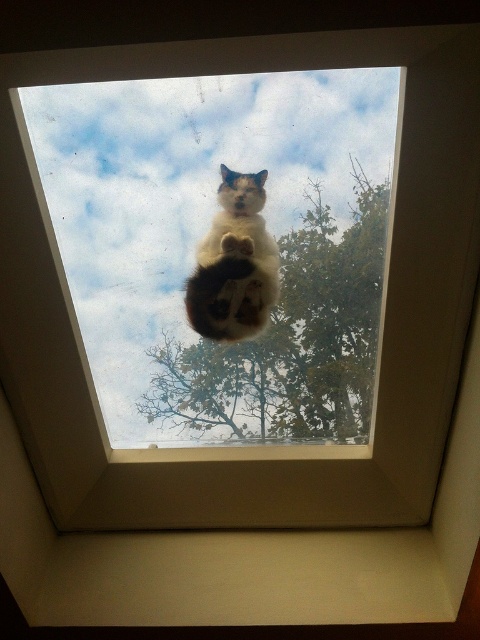
You are an observer looking up at the skylight. Which object is closer to you between the green leafy tree at center and the white fur cat at center?

The green leafy tree at center is closer to you because it is positioned in front of the white fur cat at center.